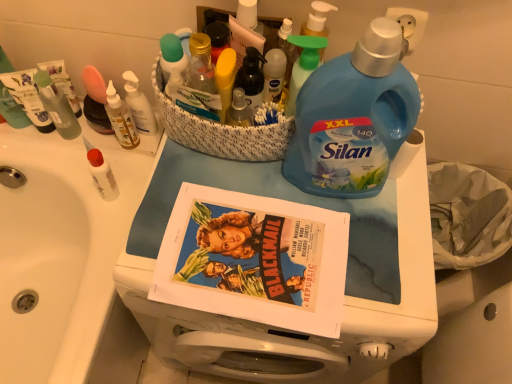
Identify the location of free space to the right of matte paper comic book at center. (373, 271).